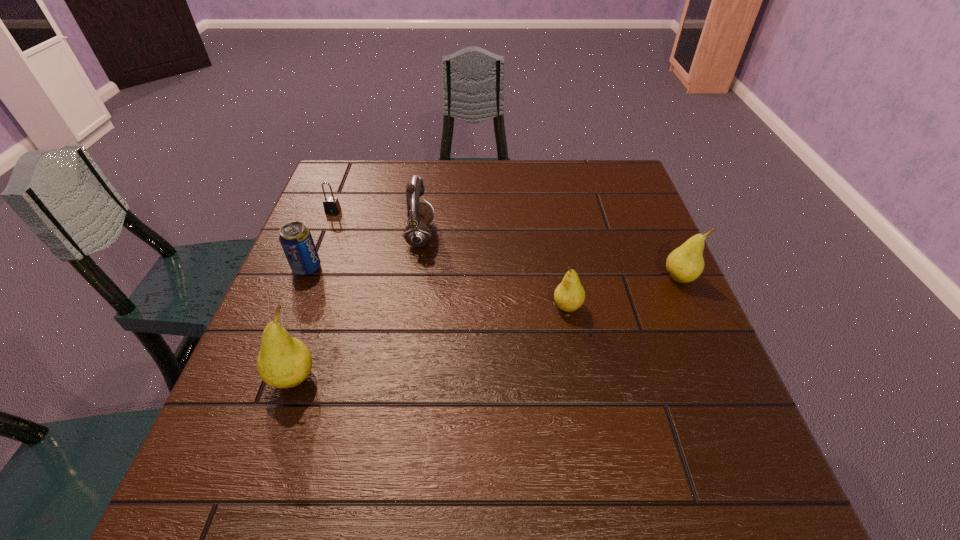
I want to click on the shortest object, so tap(331, 204).

Identify the location of vacant space located 0.070m on the front of the leftmost pear. The width and height of the screenshot is (960, 540). click(x=274, y=436).

Locate an element on the screen. This screenshot has width=960, height=540. free point located 0.130m on the left of the fifth farthest object is located at coordinates (493, 308).

Find the location of a particular element. The width and height of the screenshot is (960, 540). free space located on the left of the rightmost pear is located at coordinates (615, 279).

I want to click on vacant area located 0.320m on the right of the soda, so click(x=453, y=268).

The image size is (960, 540). I want to click on free spot located 0.400m on the ear pads of the earphone, so click(587, 236).

The height and width of the screenshot is (540, 960). I want to click on vacant region located on the shackle of the padlock, so click(309, 272).

Where is `object that is at the near edge`? The width and height of the screenshot is (960, 540). object that is at the near edge is located at coordinates (283, 362).

Where is `pear that is at the left edge`? Image resolution: width=960 pixels, height=540 pixels. pear that is at the left edge is located at coordinates (283, 362).

Where is `soda situated at the left edge`? soda situated at the left edge is located at coordinates (296, 240).